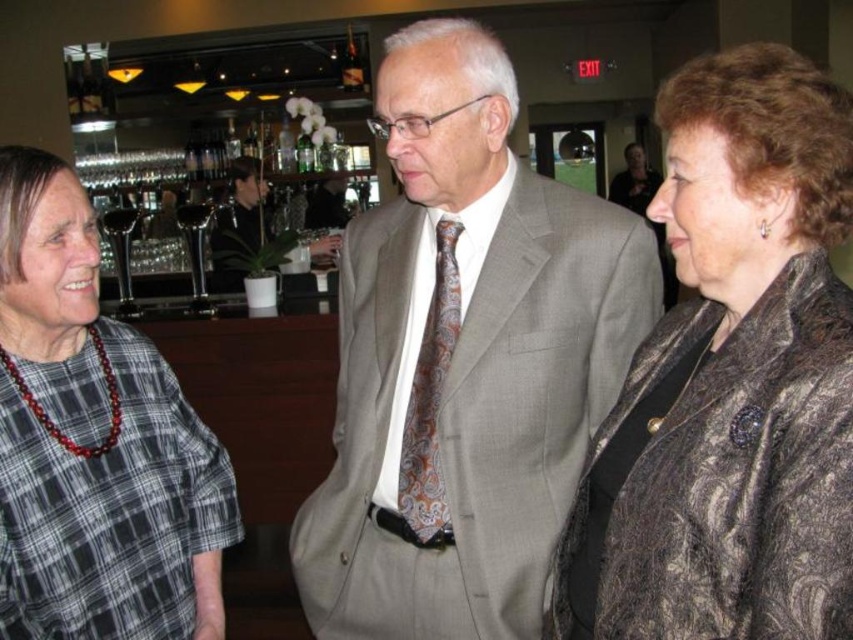
Question: Which object is the farthest from the plaid fabric shirt at left?

Choices:
 (A) light gray suit at center
 (B) shiny brown leather jacket at center right

Answer: (B)

Question: Which point is farther to the camera?

Choices:
 (A) plaid fabric shirt at left
 (B) shiny brown leather jacket at center right
 (C) paisley-patterned silk tie at center
 (D) light gray suit at center

Answer: (C)

Question: Is plaid fabric shirt at left behind paisley-patterned silk tie at center?

Choices:
 (A) no
 (B) yes

Answer: (A)

Question: Observing the image, what is the correct spatial positioning of shiny brown leather jacket at center right in reference to paisley-patterned silk tie at center?

Choices:
 (A) left
 (B) right

Answer: (B)

Question: Is shiny brown leather jacket at center right behind plaid fabric shirt at left?

Choices:
 (A) yes
 (B) no

Answer: (B)

Question: Which point appears closest to the camera in this image?

Choices:
 (A) (418, 141)
 (B) (718, 240)

Answer: (B)